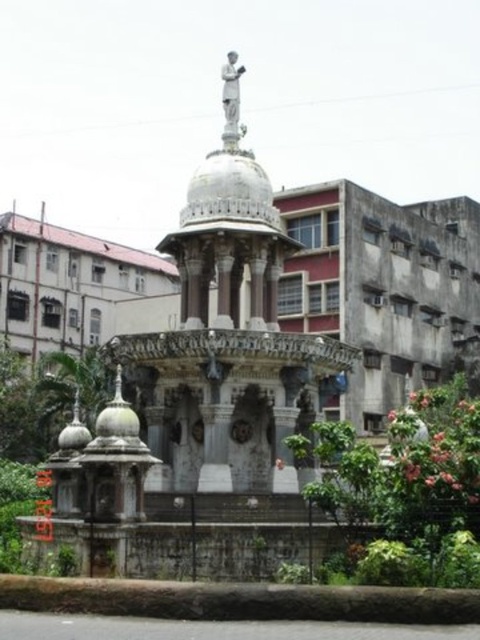
Question: Does white marble fountain at center have a smaller size compared to white marble statue at upper center?

Choices:
 (A) no
 (B) yes

Answer: (A)

Question: Can you confirm if white marble fountain at center is wider than white marble statue at upper center?

Choices:
 (A) yes
 (B) no

Answer: (A)

Question: Is white marble fountain at center positioned behind white marble statue at upper center?

Choices:
 (A) no
 (B) yes

Answer: (A)

Question: Among these objects, which one is farthest from the camera?

Choices:
 (A) white marble fountain at center
 (B) white marble statue at upper center

Answer: (B)